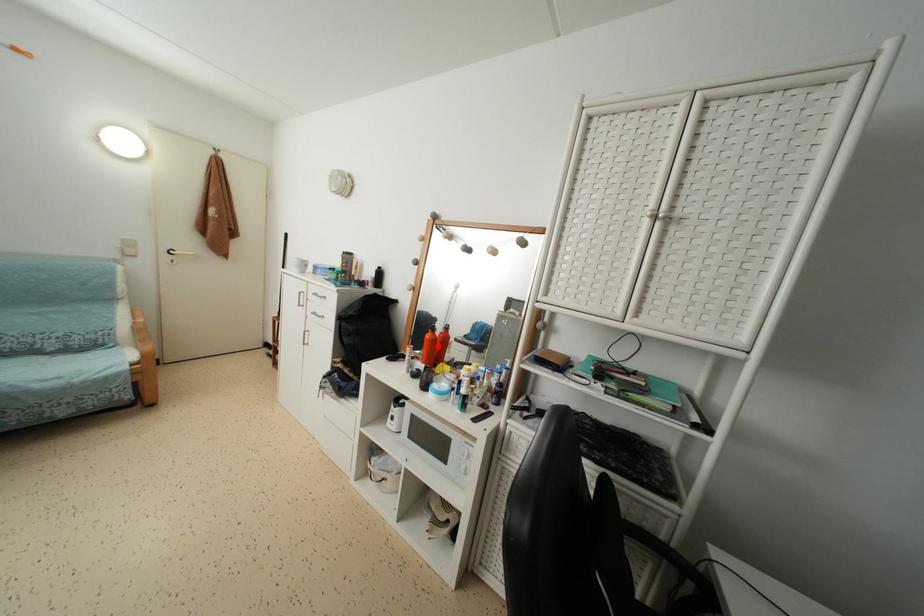
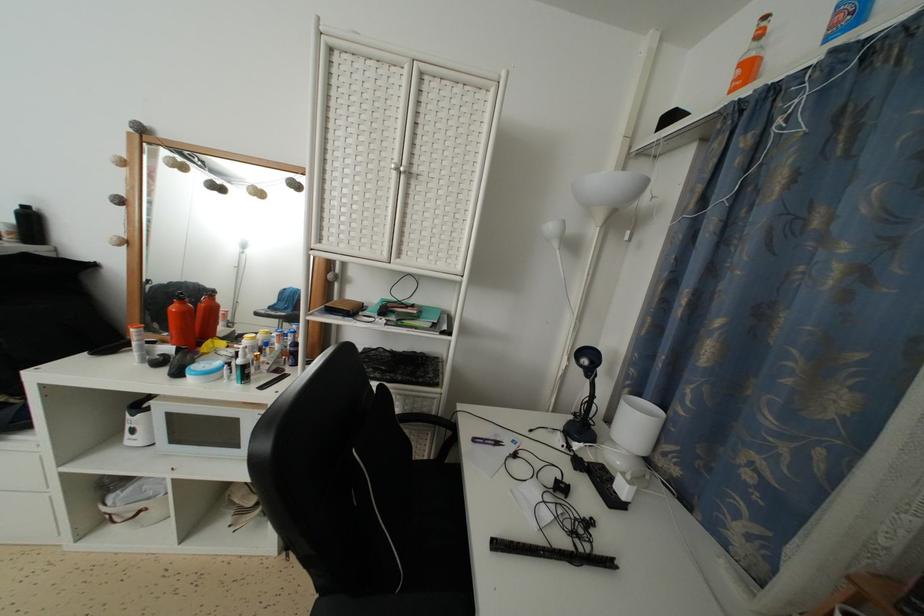
In the second image, find the point that corresponds to the highlighted location in the first image.

(192, 318)